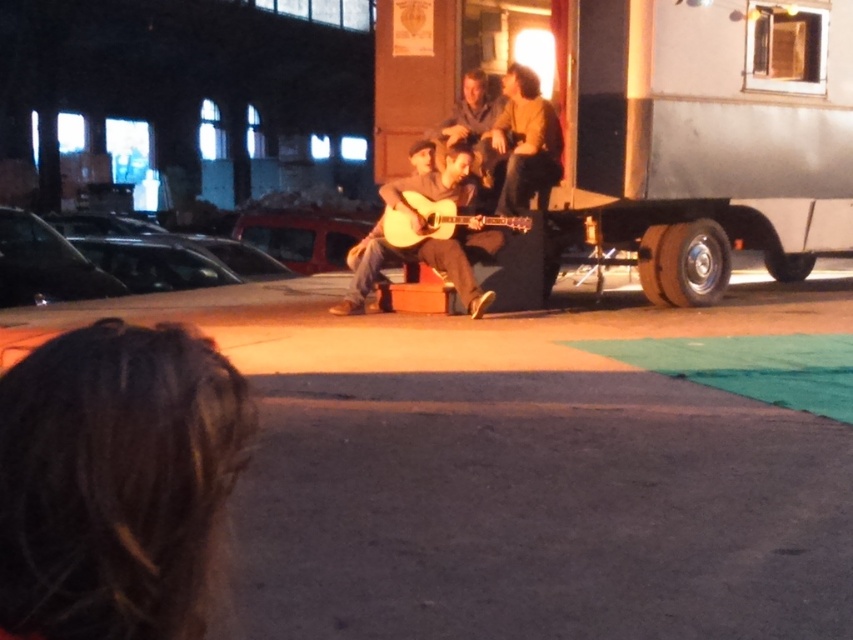
Question: Is wooden acoustic guitar at center bigger than acoustic wood guitar at center?

Choices:
 (A) no
 (B) yes

Answer: (B)

Question: Which of the following is the closest to the observer?

Choices:
 (A) wooden acoustic guitar at center
 (B) acoustic wood guitar at center

Answer: (A)

Question: Which of the following is the farthest from the observer?

Choices:
 (A) wooden acoustic guitar at center
 (B) acoustic wood guitar at center

Answer: (B)

Question: Considering the relative positions of wooden acoustic guitar at center and acoustic wood guitar at center in the image provided, where is wooden acoustic guitar at center located with respect to acoustic wood guitar at center?

Choices:
 (A) above
 (B) below

Answer: (B)

Question: Is wooden acoustic guitar at center positioned at the back of acoustic wood guitar at center?

Choices:
 (A) yes
 (B) no

Answer: (B)